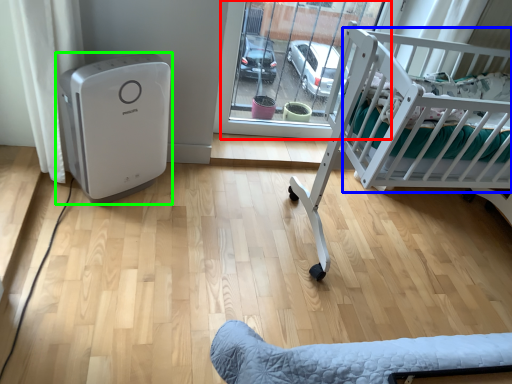
Question: Based on their relative distances, which object is nearer to glass door (highlighted by a red box)? Choose from infant bed (highlighted by a blue box) and home appliance (highlighted by a green box).

Choices:
 (A) infant bed
 (B) home appliance

Answer: (A)